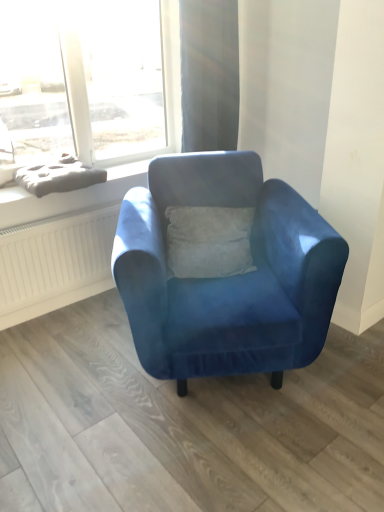
What is the approximate height of matte gray cushion at upper left?

matte gray cushion at upper left is 4.14 inches tall.

Find the location of a particular element. This screenshot has width=384, height=512. satin beige curtain at upper center is located at coordinates (209, 74).

What do you see at coordinates (69, 196) in the screenshot?
I see `gray fabric cushion at upper left` at bounding box center [69, 196].

This screenshot has width=384, height=512. Identify the location of velvet blue armchair at center. (228, 278).

From the image's perspective, which one is positioned higher, gray fabric cushion at upper left or satin beige curtain at upper center?

From the image's view, satin beige curtain at upper center is above.

Does gray fabric cushion at upper left have a lesser height compared to satin beige curtain at upper center?

Indeed, gray fabric cushion at upper left has a lesser height compared to satin beige curtain at upper center.

Looking at this image, in terms of width, does gray fabric cushion at upper left look wider or thinner when compared to satin beige curtain at upper center?

Considering their sizes, gray fabric cushion at upper left looks broader than satin beige curtain at upper center.

Is point (105, 184) positioned after point (213, 109)?

No, (105, 184) is closer to viewer.

From the image's perspective, which one is positioned lower, gray fabric cushion at upper left or velvet blue armchair at center?

velvet blue armchair at center, from the image's perspective.

Is gray fabric cushion at upper left located outside velvet blue armchair at center?

Yes, gray fabric cushion at upper left is not within velvet blue armchair at center.

From a real-world perspective, is gray fabric cushion at upper left under velvet blue armchair at center?

No, from a real-world perspective, gray fabric cushion at upper left is not below velvet blue armchair at center.

Is velvet blue armchair at center directly adjacent to matte gray cushion at upper left?

There is a gap between velvet blue armchair at center and matte gray cushion at upper left.

From the image's perspective, which object appears higher, velvet blue armchair at center or matte gray cushion at upper left?

matte gray cushion at upper left.

Is velvet blue armchair at center taller or shorter than matte gray cushion at upper left?

In the image, velvet blue armchair at center appears to be taller than matte gray cushion at upper left.

Which object is further away from the camera taking this photo, velvet blue armchair at center or matte gray cushion at upper left?

matte gray cushion at upper left.

From the image's perspective, is satin beige curtain at upper center above or below matte gray cushion at upper left?

Based on their image positions, satin beige curtain at upper center is located above matte gray cushion at upper left.

Who is shorter, satin beige curtain at upper center or matte gray cushion at upper left?

matte gray cushion at upper left.

Can we say satin beige curtain at upper center lies outside matte gray cushion at upper left?

Absolutely, satin beige curtain at upper center is external to matte gray cushion at upper left.

Measure the distance between satin beige curtain at upper center and matte gray cushion at upper left.

satin beige curtain at upper center is 31.75 inches away from matte gray cushion at upper left.

How many degrees apart are the facing directions of gray fabric cushion at upper left and matte gray cushion at upper left?

gray fabric cushion at upper left and matte gray cushion at upper left are facing 2.42 degrees away from each other.

From the image's perspective, is gray fabric cushion at upper left above or below matte gray cushion at upper left?

gray fabric cushion at upper left is situated higher than matte gray cushion at upper left in the image.

Which is in front, point (48, 203) or point (32, 177)?

The point (32, 177) is in front.

Consider the image. Is velvet blue armchair at center looking in the opposite direction of gray fabric cushion at upper left?

Yes, gray fabric cushion at upper left is at the back of velvet blue armchair at center.

From a real-world perspective, between velvet blue armchair at center and gray fabric cushion at upper left, who is vertically lower?

From a 3D spatial view, velvet blue armchair at center is below.

Is point (128, 206) closer to viewer compared to point (118, 182)?

Yes.

Based on the photo, which object is wider, velvet blue armchair at center or gray fabric cushion at upper left?

velvet blue armchair at center.

Are matte gray cushion at upper left and gray fabric cushion at upper left making contact?

There is a gap between matte gray cushion at upper left and gray fabric cushion at upper left.

Could gray fabric cushion at upper left be considered to be inside matte gray cushion at upper left?

Definitely not — gray fabric cushion at upper left is not inside matte gray cushion at upper left.

From the picture: Considering the sizes of objects matte gray cushion at upper left and gray fabric cushion at upper left in the image provided, who is taller, matte gray cushion at upper left or gray fabric cushion at upper left?

Standing taller between the two is matte gray cushion at upper left.

Which object is positioned more to the right, matte gray cushion at upper left or gray fabric cushion at upper left?

From the viewer's perspective, gray fabric cushion at upper left appears more on the right side.

Locate an element on the screen. The image size is (384, 512). window sill that is on the left side of satin beige curtain at upper center is located at coordinates (69, 196).

Where is `chair below the gray fabric cushion at upper left (from a real-world perspective)`? This screenshot has height=512, width=384. chair below the gray fabric cushion at upper left (from a real-world perspective) is located at coordinates (228, 278).

Based on their spatial positions, is matte gray cushion at upper left or velvet blue armchair at center further from gray fabric cushion at upper left?

Based on the image, velvet blue armchair at center appears to be further to gray fabric cushion at upper left.

Estimate the real-world distances between objects in this image. Which object is further from velvet blue armchair at center, matte gray cushion at upper left or satin beige curtain at upper center?

satin beige curtain at upper center lies further to velvet blue armchair at center than the other object.

Estimate the real-world distances between objects in this image. Which object is further from matte gray cushion at upper left, satin beige curtain at upper center or gray fabric cushion at upper left?

Based on the image, satin beige curtain at upper center appears to be further to matte gray cushion at upper left.

Looking at the image, which one is located closer to velvet blue armchair at center, gray fabric cushion at upper left or matte gray cushion at upper left?

gray fabric cushion at upper left is positioned closer to the anchor velvet blue armchair at center.

Based on their spatial positions, is satin beige curtain at upper center or velvet blue armchair at center further from matte gray cushion at upper left?

Based on the image, velvet blue armchair at center appears to be further to matte gray cushion at upper left.

Looking at the image, which one is located closer to matte gray cushion at upper left, gray fabric cushion at upper left or velvet blue armchair at center?

gray fabric cushion at upper left is positioned closer to the anchor matte gray cushion at upper left.

Looking at the image, which one is located closer to matte gray cushion at upper left, velvet blue armchair at center or satin beige curtain at upper center?

satin beige curtain at upper center is positioned closer to the anchor matte gray cushion at upper left.

Which object lies further to the anchor point satin beige curtain at upper center, gray fabric cushion at upper left or velvet blue armchair at center?

The object further to satin beige curtain at upper center is velvet blue armchair at center.

At what (x,y) coordinates should I click in order to perform the action: click on window sill situated between matte gray cushion at upper left and satin beige curtain at upper center from left to right. Please return your answer as a coordinate pair (x, y). The image size is (384, 512). Looking at the image, I should click on (69, 196).

You are a GUI agent. You are given a task and a screenshot of the screen. Output one action in this format:
    pyautogui.click(x=<x>, y=<y>)
    Task: Click on the material between velvet blue armchair at center and gray fabric cushion at upper left along the z-axis
    This screenshot has width=384, height=512.
    Given the screenshot: What is the action you would take?
    pyautogui.click(x=58, y=176)

This screenshot has height=512, width=384. Identify the location of window sill between satin beige curtain at upper center and velvet blue armchair at center vertically. (69, 196).

Identify the location of material between satin beige curtain at upper center and velvet blue armchair at center from top to bottom. (58, 176).